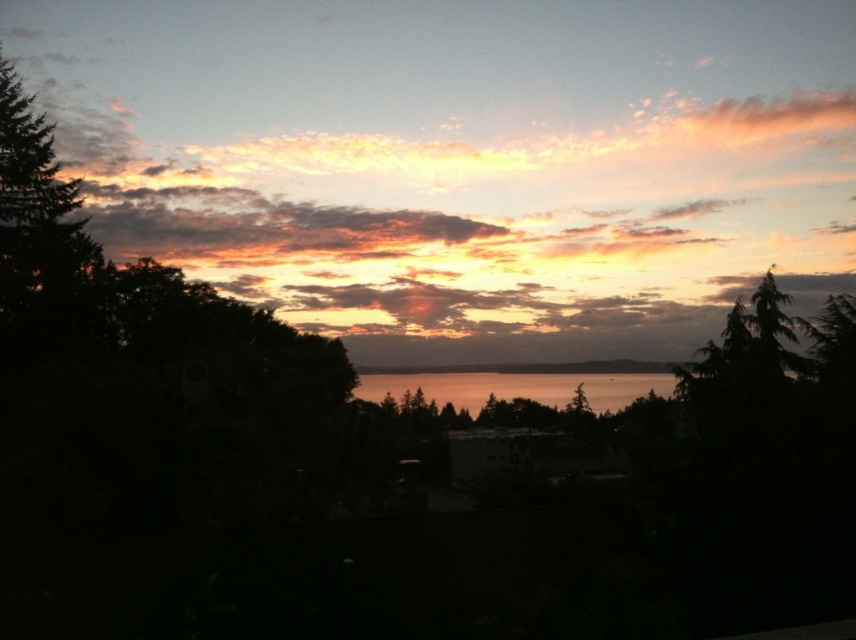
Question: From the image, what is the correct spatial relationship of cloudy sky at upper center in relation to shiny metallic water at center?

Choices:
 (A) left
 (B) right

Answer: (A)

Question: Is cloudy sky at upper center to the right of shiny metallic water at center from the viewer's perspective?

Choices:
 (A) yes
 (B) no

Answer: (B)

Question: Among these objects, which one is nearest to the camera?

Choices:
 (A) cloudy sky at upper center
 (B) shiny metallic water at center

Answer: (A)

Question: Is cloudy sky at upper center below shiny metallic water at center?

Choices:
 (A) yes
 (B) no

Answer: (B)